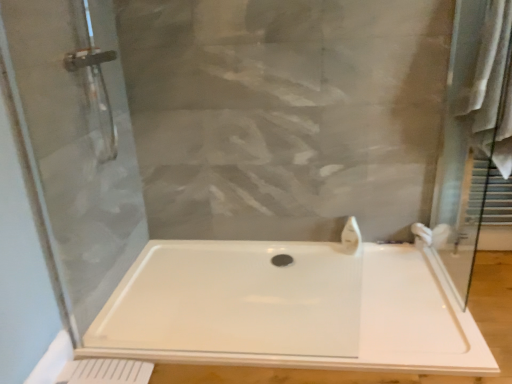
Find the location of a particular element. The height and width of the screenshot is (384, 512). free space to the left of white glossy faucet at upper right is located at coordinates (318, 256).